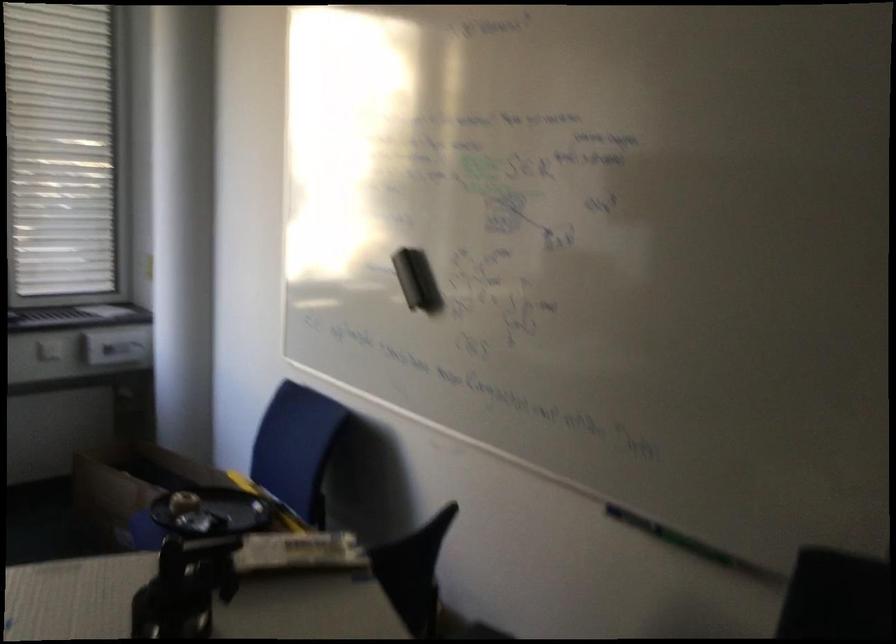
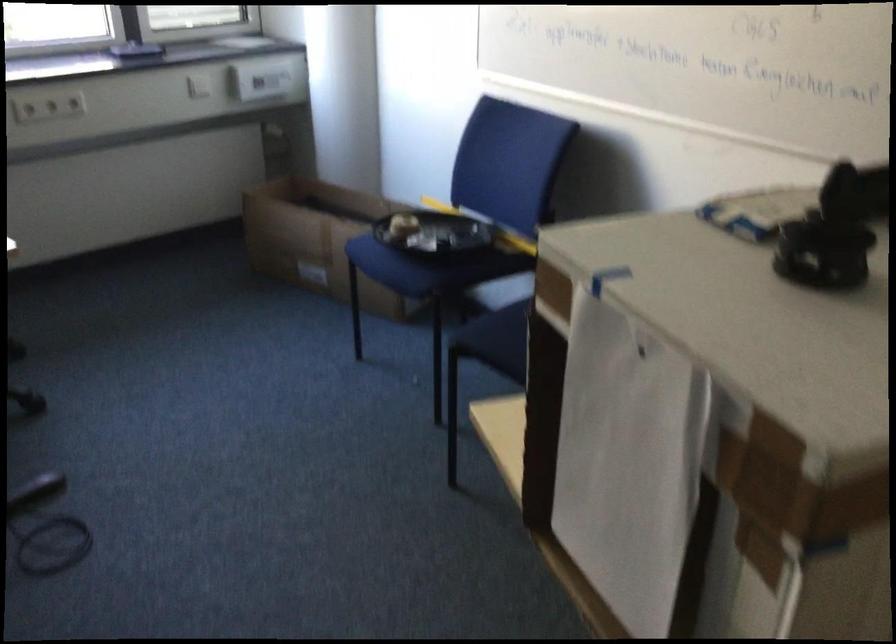
Question: The first image is from the beginning of the video and the second image is from the end. How did the camera likely rotate when shooting the video?

Choices:
 (A) Left
 (B) Right
 (C) Up
 (D) Down

Answer: (D)